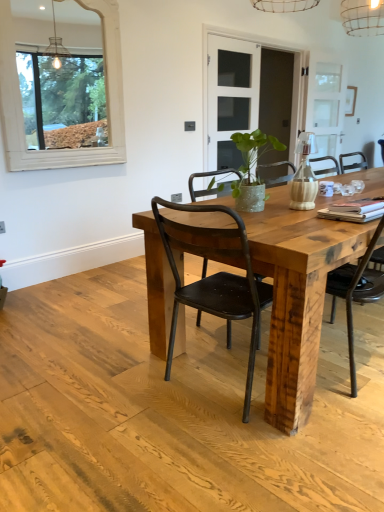
Locate an element on the screen. free space in front of matte white vase at center is located at coordinates (300, 216).